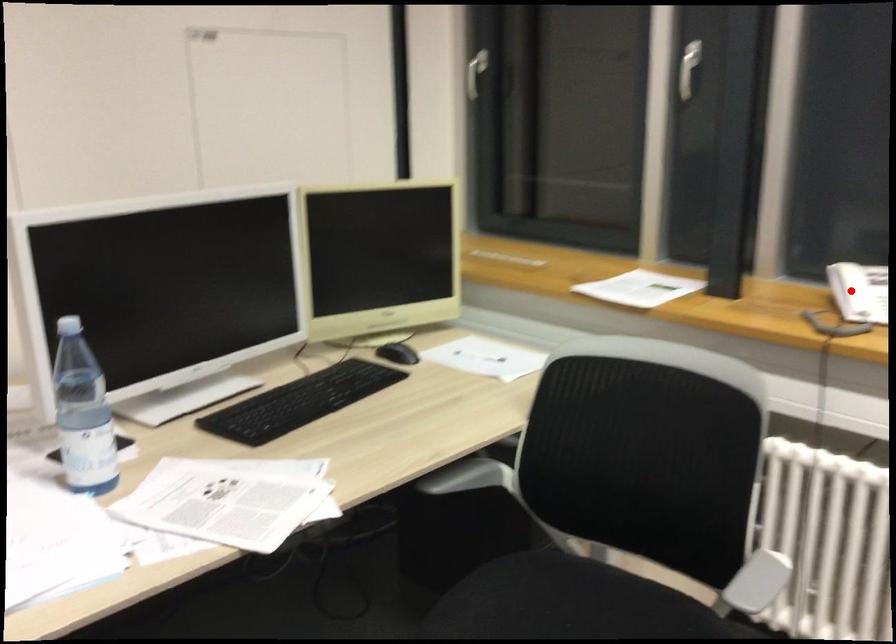
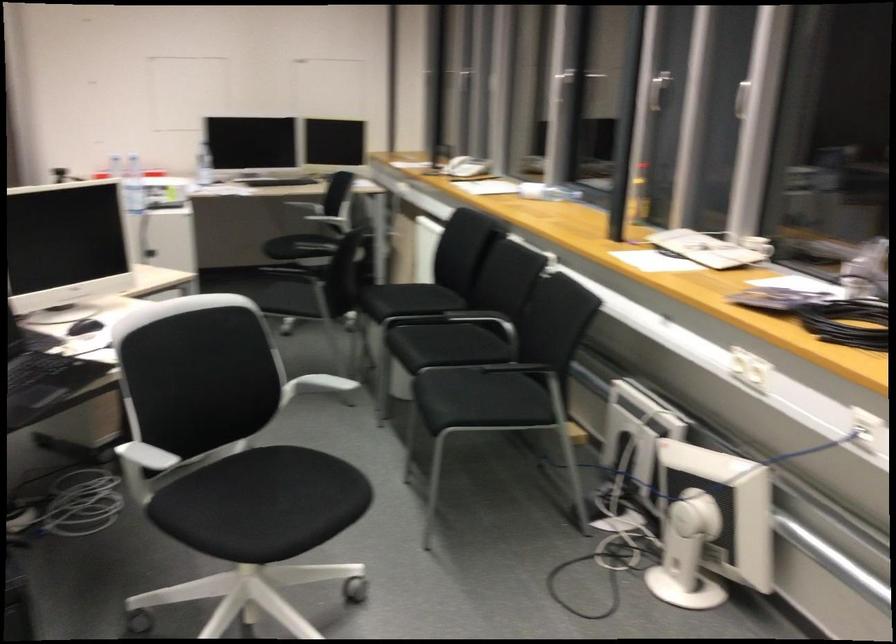
Locate, in the second image, the point that corresponds to the highlighted location in the first image.

(454, 154)